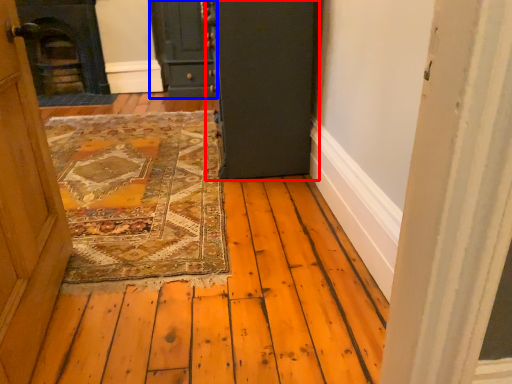
Question: Which point is closer to the camera, door (highlighted by a red box) or door (highlighted by a blue box)?

Choices:
 (A) door
 (B) door

Answer: (A)